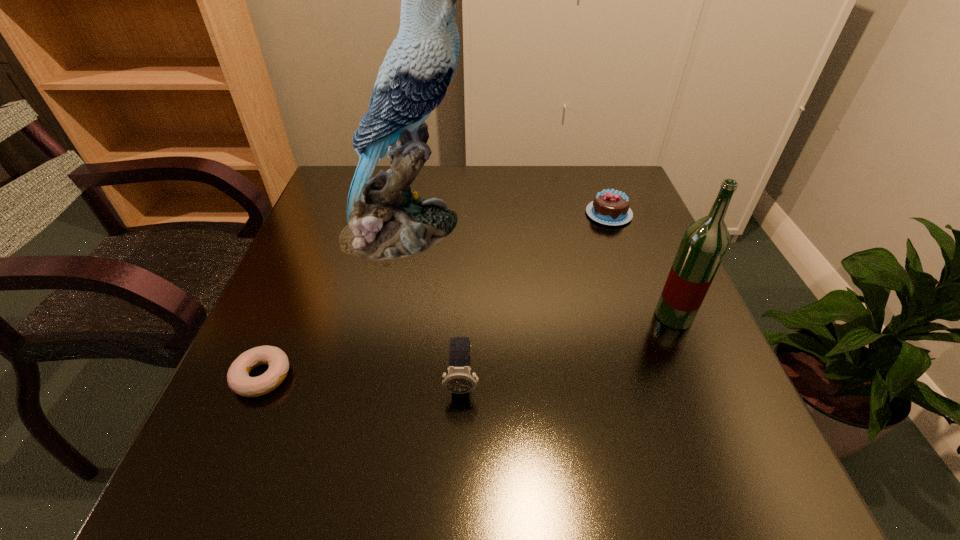
Find the location of `vacant area situated on the back of the doughnut`. vacant area situated on the back of the doughnut is located at coordinates (299, 291).

Where is `parakeet situated at the far edge`? Image resolution: width=960 pixels, height=540 pixels. parakeet situated at the far edge is located at coordinates (386, 220).

The image size is (960, 540). Find the location of `chocolate cake positioned at the far edge`. chocolate cake positioned at the far edge is located at coordinates (610, 207).

Locate an element on the screen. The image size is (960, 540). parakeet that is at the left edge is located at coordinates (386, 220).

The image size is (960, 540). In order to click on doughnut that is at the left edge in this screenshot , I will do `click(238, 378)`.

Image resolution: width=960 pixels, height=540 pixels. I want to click on liquor present at the right edge, so click(x=704, y=244).

The width and height of the screenshot is (960, 540). I want to click on chocolate cake positioned at the right edge, so pos(610,207).

The image size is (960, 540). I want to click on object that is positioned at the far left corner, so click(386, 220).

This screenshot has width=960, height=540. I want to click on object at the far right corner, so click(610, 207).

In the image, there is a desktop. Identify the location of free space at the far edge. The height and width of the screenshot is (540, 960). (531, 165).